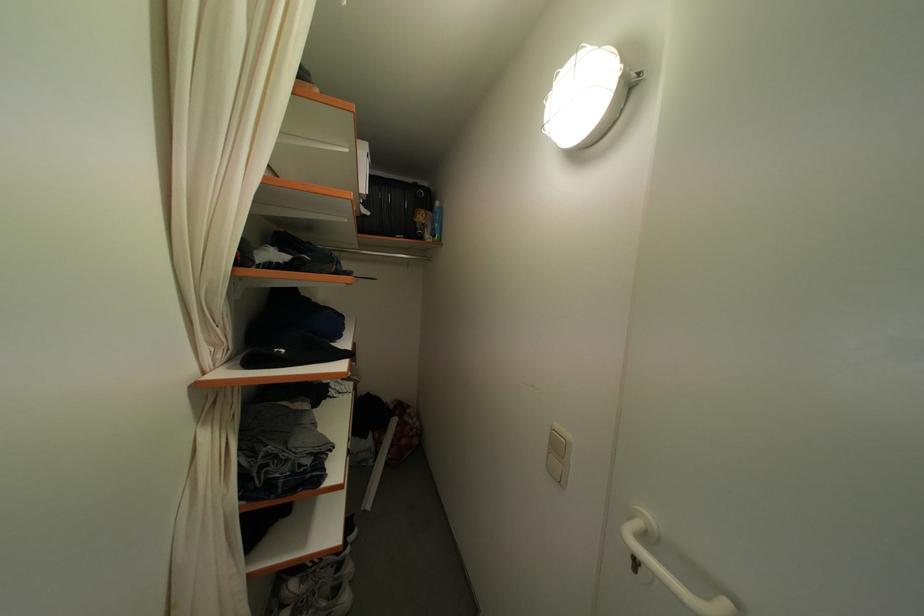
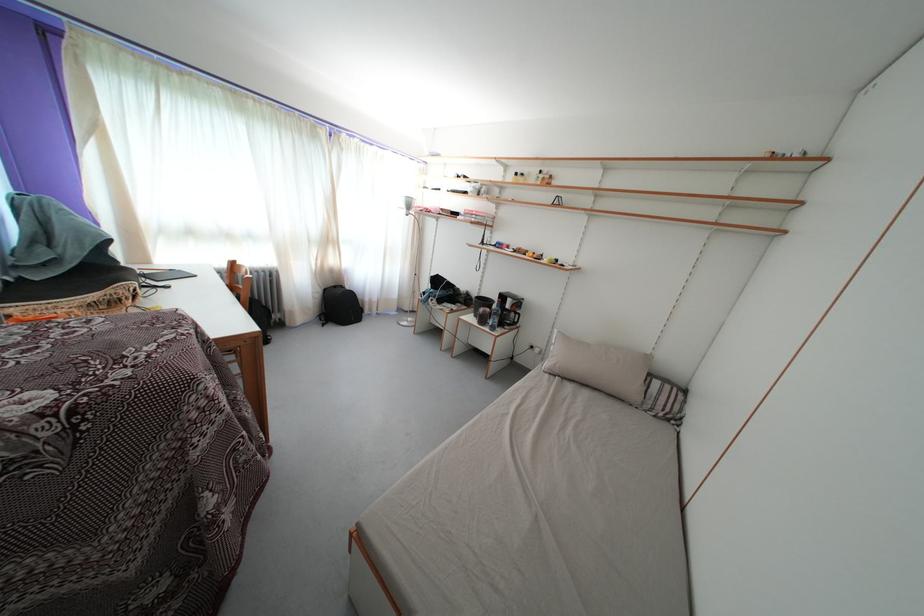
Question: The camera is either moving clockwise (left) or counter-clockwise (right) around the object. The first image is from the beginning of the video and the second image is from the end. Is the camera moving left or right when shooting the video?

Choices:
 (A) Left
 (B) Right

Answer: (B)